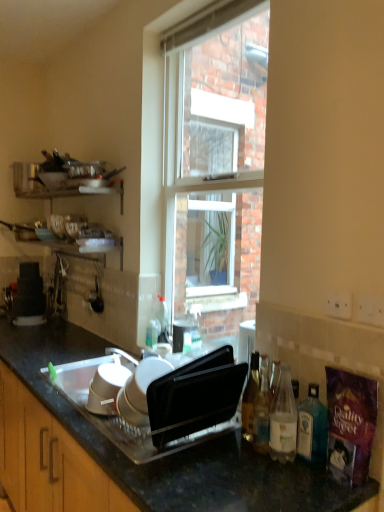
Locate an element on the screen. The height and width of the screenshot is (512, 384). free space in front of translucent glass bottle at lower right, acting as the third bottle starting from the left is located at coordinates (285, 483).